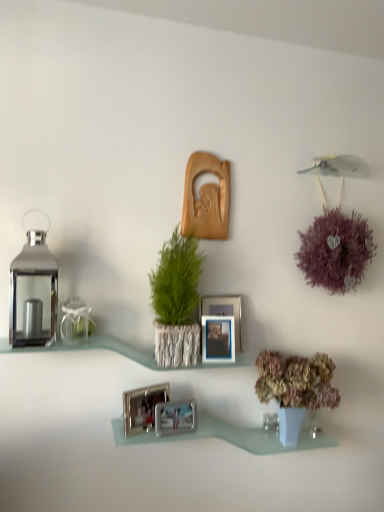
At what (x,y) coordinates should I click in order to perform the action: click on clear glass shelf at center, which is the first shelf in top-to-bottom order. Please return your answer as a coordinate pair (x, y). Looking at the image, I should click on (121, 352).

What is the approximate height of purple fluffy ball at upper right?

24.77 inches.

You are a GUI agent. You are given a task and a screenshot of the screen. Output one action in this format:
    pyautogui.click(x=<x>, y=<y>)
    Task: Click on the silver metallic picture frame at center, which is the fourth picture frame from bottom to top
    The height and width of the screenshot is (512, 384).
    Given the screenshot: What is the action you would take?
    pyautogui.click(x=224, y=311)

At what (x,y) coordinates should I click in order to perform the action: click on shelf that is the 1st one when counting forward from the metallic silver picture frame at center, which is the 3th picture frame in top-to-bottom order. Please return your answer as a coordinate pair (x, y). This screenshot has height=512, width=384. Looking at the image, I should click on (230, 436).

Between metallic silver picture frame at center, which is the 3th picture frame in top-to-bottom order, and silver metallic photo frames at center, which is the 2th shelf from top to bottom, which one has larger size?

Bigger between the two is silver metallic photo frames at center, which is the 2th shelf from top to bottom.

Is metallic silver picture frame at center, which is the 3th picture frame in top-to-bottom order, surrounding silver metallic photo frames at center, which is the 2th shelf from top to bottom?

No, silver metallic photo frames at center, which is the 2th shelf from top to bottom, is located outside of metallic silver picture frame at center, which is the 3th picture frame in top-to-bottom order.

From the image's perspective, which one is positioned lower, metallic silver picture frame at center, which is the 3th picture frame in top-to-bottom order, or silver metallic photo frames at center, arranged as the first shelf when ordered from the bottom?

silver metallic photo frames at center, arranged as the first shelf when ordered from the bottom, appears lower in the image.

Is metallic silver picture frame at center, which is counted as the third picture frame, starting from the bottom, at the left side of clear glass shelf at center, the second shelf ordered from the bottom?

No, metallic silver picture frame at center, which is counted as the third picture frame, starting from the bottom, is not to the left of clear glass shelf at center, the second shelf ordered from the bottom.

Is metallic silver picture frame at center, which is the 3th picture frame in top-to-bottom order, closer to camera compared to clear glass shelf at center, which is the first shelf in top-to-bottom order?

No, metallic silver picture frame at center, which is the 3th picture frame in top-to-bottom order, is further to the viewer.

Image resolution: width=384 pixels, height=512 pixels. Identify the location of shelf that is the 1st one when counting downward from the metallic silver picture frame at center, which is counted as the third picture frame, starting from the bottom (from the image's perspective). (121, 352).

Looking at this image, considering the relative sizes of metallic silver picture frame at center, which is the 3th picture frame in top-to-bottom order, and clear glass shelf at center, the second shelf ordered from the bottom, in the image provided, is metallic silver picture frame at center, which is the 3th picture frame in top-to-bottom order, bigger than clear glass shelf at center, the second shelf ordered from the bottom,?

Actually, metallic silver picture frame at center, which is the 3th picture frame in top-to-bottom order, might be smaller than clear glass shelf at center, the second shelf ordered from the bottom.

Based on the photo, is silver metallic photo frame at lower center, which appears as the second picture frame when ordered from the bottom, wider or thinner than green textured plant at center?

Clearly, silver metallic photo frame at lower center, which appears as the second picture frame when ordered from the bottom, has less width compared to green textured plant at center.

Is silver metallic photo frame at lower center, which appears as the second picture frame when ordered from the bottom, with green textured plant at center?

No, silver metallic photo frame at lower center, which appears as the second picture frame when ordered from the bottom, is not beside green textured plant at center.

From the image's perspective, is silver metallic photo frame at lower center, the fourth picture frame viewed from the top, on top of green textured plant at center?

No, from the image's perspective, silver metallic photo frame at lower center, the fourth picture frame viewed from the top, is not above green textured plant at center.

Based on their positions, is silver metallic photo frame at lower center, the fourth picture frame viewed from the top, located to the left or right of green textured plant at center?

silver metallic photo frame at lower center, the fourth picture frame viewed from the top, is to the left of green textured plant at center.

From a real-world perspective, between clear glass shelf at center, which is the first shelf in top-to-bottom order, and metallic silver picture frame at center, which is counted as the third picture frame, starting from the bottom, who is vertically lower?

clear glass shelf at center, which is the first shelf in top-to-bottom order, is physically lower.

From the image's perspective, does clear glass shelf at center, the second shelf ordered from the bottom, appear lower than metallic silver picture frame at center, which is the 3th picture frame in top-to-bottom order?

Yes.

There is a clear glass shelf at center, the second shelf ordered from the bottom. Where is `the 1st picture frame above it (from the image's perspective)`? The width and height of the screenshot is (384, 512). the 1st picture frame above it (from the image's perspective) is located at coordinates (218, 339).

Based on the photo, is clear glass shelf at center, the second shelf ordered from the bottom, taller or shorter than metallic silver picture frame at center, which is counted as the third picture frame, starting from the bottom?

clear glass shelf at center, the second shelf ordered from the bottom, is shorter than metallic silver picture frame at center, which is counted as the third picture frame, starting from the bottom.

Is clear glass shelf at center, which is the first shelf in top-to-bottom order, to the left of silver metallic photo frame at lower center, which appears as the second picture frame when ordered from the bottom, from the viewer's perspective?

→ Yes, clear glass shelf at center, which is the first shelf in top-to-bottom order, is to the left of silver metallic photo frame at lower center, which appears as the second picture frame when ordered from the bottom.

Is clear glass shelf at center, the second shelf ordered from the bottom, taller or shorter than silver metallic photo frame at lower center, the fourth picture frame viewed from the top?

clear glass shelf at center, the second shelf ordered from the bottom, is shorter than silver metallic photo frame at lower center, the fourth picture frame viewed from the top.

From the picture: From a real-world perspective, which is physically below, clear glass shelf at center, which is the first shelf in top-to-bottom order, or silver metallic photo frame at lower center, the fourth picture frame viewed from the top?

In real-world perspective, silver metallic photo frame at lower center, the fourth picture frame viewed from the top, is lower.

Is clear glass shelf at center, which is the first shelf in top-to-bottom order, positioned beyond the bounds of silver metallic photo frame at lower center, which appears as the second picture frame when ordered from the bottom?

Yes, clear glass shelf at center, which is the first shelf in top-to-bottom order, is located beyond the bounds of silver metallic photo frame at lower center, which appears as the second picture frame when ordered from the bottom.

Is silver metallic picture frame at center, which is the fourth picture frame from bottom to top, facing away from silver metallic photo frames at center, which is the 2th shelf from top to bottom?

No.

Between silver metallic picture frame at center, which is the fourth picture frame from bottom to top, and silver metallic photo frames at center, arranged as the first shelf when ordered from the bottom, which one appears on the left side from the viewer's perspective?

silver metallic picture frame at center, which is the fourth picture frame from bottom to top, is more to the left.

From a real-world perspective, between silver metallic picture frame at center, the 2th picture frame positioned from the top, and silver metallic photo frames at center, which is the 2th shelf from top to bottom, who is vertically higher?

silver metallic picture frame at center, the 2th picture frame positioned from the top, from a real-world perspective.

Could you tell me if clear glass shelf at center, which is the first shelf in top-to-bottom order, is facing green textured plant at center?

No.

Which object is closer to the camera taking this photo, clear glass shelf at center, the second shelf ordered from the bottom, or green textured plant at center?

clear glass shelf at center, the second shelf ordered from the bottom, is closer to the camera.

From the image's perspective, which is above, clear glass shelf at center, which is the first shelf in top-to-bottom order, or green textured plant at center?

green textured plant at center.

Considering the relative sizes of clear glass shelf at center, the second shelf ordered from the bottom, and green textured plant at center in the image provided, is clear glass shelf at center, the second shelf ordered from the bottom, smaller than green textured plant at center?

Indeed, clear glass shelf at center, the second shelf ordered from the bottom, has a smaller size compared to green textured plant at center.

This screenshot has width=384, height=512. I want to click on the 3rd picture frame above when counting from the silver metallic photo frames at center, which is the 2th shelf from top to bottom (from the image's perspective), so click(x=218, y=339).

Image resolution: width=384 pixels, height=512 pixels. I want to click on the 4th picture frame to the right of the clear glass shelf at center, the second shelf ordered from the bottom, counting from the anchor's position, so click(218, 339).

Looking at the image, which one is located further to silver metallic photo frame at center, which ranks as the fifth picture frame in top-to-bottom order, silver metallic picture frame at center, the 2th picture frame positioned from the top, or silver metallic photo frames at center, which is the 2th shelf from top to bottom?

Based on the image, silver metallic picture frame at center, the 2th picture frame positioned from the top, appears to be further to silver metallic photo frame at center, which ranks as the fifth picture frame in top-to-bottom order.

From the image, which object appears to be nearer to clear glass shelf at center, which is the first shelf in top-to-bottom order, purple fluffy ball at upper right or green textured plant at center?

green textured plant at center is positioned closer to the anchor clear glass shelf at center, which is the first shelf in top-to-bottom order.

Looking at the image, which one is located further to wooden carving at center, which is the fifth picture frame from bottom to top, silver metallic picture frame at center, the 2th picture frame positioned from the top, or clear glass shelf at center, the second shelf ordered from the bottom?

clear glass shelf at center, the second shelf ordered from the bottom, is positioned further to the anchor wooden carving at center, which is the fifth picture frame from bottom to top.

Looking at the image, which one is located further to silver metallic photo frames at center, which is the 2th shelf from top to bottom, green textured plant at center or purple fluffy ball at upper right?

purple fluffy ball at upper right is further to silver metallic photo frames at center, which is the 2th shelf from top to bottom.

When comparing their distances from wooden carving at center, which is the fifth picture frame from bottom to top, does green textured plant at center or purple fluffy ball at upper right seem further?

purple fluffy ball at upper right is positioned further to the anchor wooden carving at center, which is the fifth picture frame from bottom to top.

Based on their spatial positions, is wooden carving at center, which appears as the first picture frame when viewed from the top, or purple fluffy ball at upper right further from metallic silver picture frame at center, which is counted as the third picture frame, starting from the bottom?

The object further to metallic silver picture frame at center, which is counted as the third picture frame, starting from the bottom, is purple fluffy ball at upper right.

From the image, which object appears to be farther from green textured plant at center, clear glass shelf at center, which is the first shelf in top-to-bottom order, or silver metallic photo frame at center, which ranks as the fifth picture frame in top-to-bottom order?

Among the two, silver metallic photo frame at center, which ranks as the fifth picture frame in top-to-bottom order, is located further to green textured plant at center.

Based on the photo, looking at the image, which one is located closer to silver metallic photo frame at lower center, the fourth picture frame viewed from the top, green textured plant at center or silver metallic photo frames at center, arranged as the first shelf when ordered from the bottom?

Based on the image, silver metallic photo frames at center, arranged as the first shelf when ordered from the bottom, appears to be nearer to silver metallic photo frame at lower center, the fourth picture frame viewed from the top.

Locate an element on the screen. flower between wooden carving at center, which appears as the first picture frame when viewed from the top, and silver metallic photo frames at center, which is the 2th shelf from top to bottom, in the up-down direction is located at coordinates (336, 251).

This screenshot has width=384, height=512. Find the location of `houseplant located between clear glass shelf at center, which is the first shelf in top-to-bottom order, and metallic silver picture frame at center, which is the 3th picture frame in top-to-bottom order, in the left-right direction`. houseplant located between clear glass shelf at center, which is the first shelf in top-to-bottom order, and metallic silver picture frame at center, which is the 3th picture frame in top-to-bottom order, in the left-right direction is located at coordinates (176, 301).

At what (x,y) coordinates should I click in order to perform the action: click on picture frame between metallic silver picture frame at center, which is the 3th picture frame in top-to-bottom order, and purple fluffy ball at upper right, in the horizontal direction. Please return your answer as a coordinate pair (x, y). The image size is (384, 512). Looking at the image, I should click on (224, 311).

Locate an element on the screen. shelf that lies between green textured plant at center and silver metallic photo frame at center, arranged as the 1th picture frame when ordered from the bottom, from top to bottom is located at coordinates (121, 352).